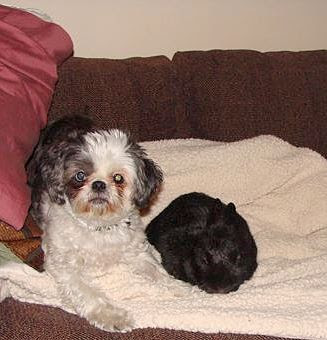
The image size is (327, 340). What are the coordinates of `couch` in the screenshot? It's located at (264, 133).